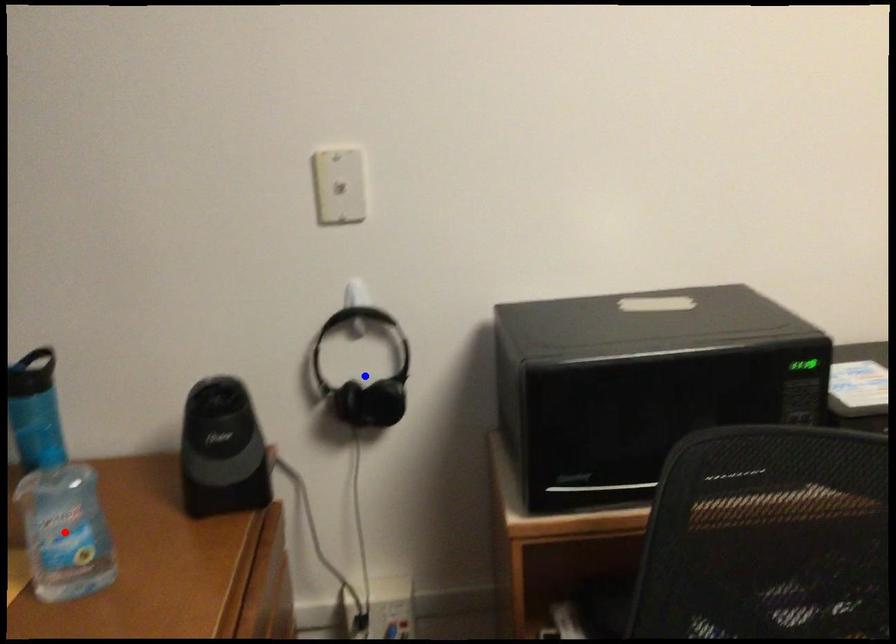
Question: Two points are marked on the image. Which point is closer to the camera?

Choices:
 (A) Blue point is closer.
 (B) Red point is closer.

Answer: (B)